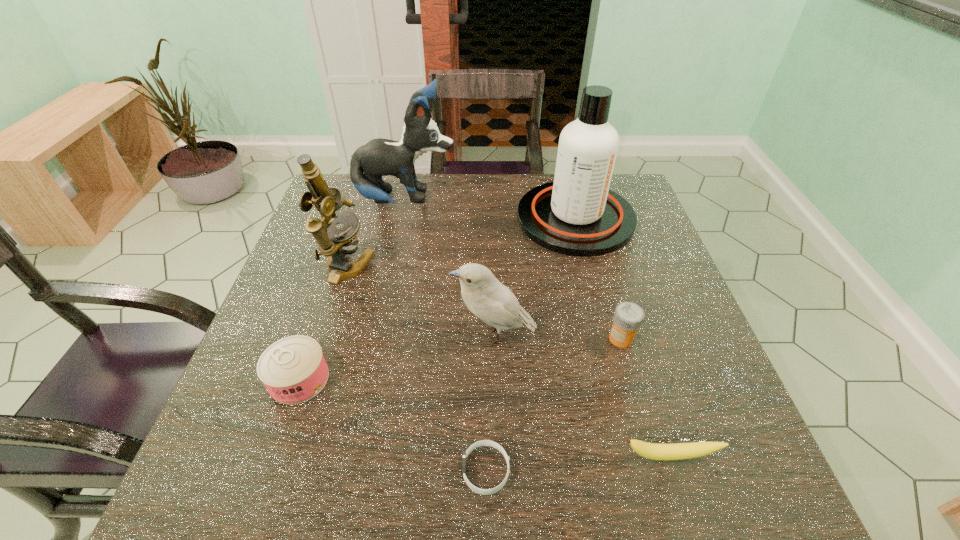
I want to click on cleansing agent, so click(577, 214).

Identify the location of puppy. Image resolution: width=960 pixels, height=540 pixels. (379, 157).

Identify the location of microscope. (x=334, y=243).

Find the location of a particular element. The image size is (960, 540). the fourth tallest object is located at coordinates (487, 298).

What are the coordinates of `the fifth tallest object` in the screenshot? It's located at pos(628,316).

Find the location of a particular element. can is located at coordinates (293, 369).

What are the coordinates of `banana` in the screenshot? It's located at (661, 452).

The image size is (960, 540). Identify the location of wristband. (483, 442).

Identify the location of free space located 0.290m on the left of the cleansing agent. (414, 218).

Find the location of a particular element. This screenshot has width=960, height=540. free location located on the front-facing side of the puppy is located at coordinates [564, 200].